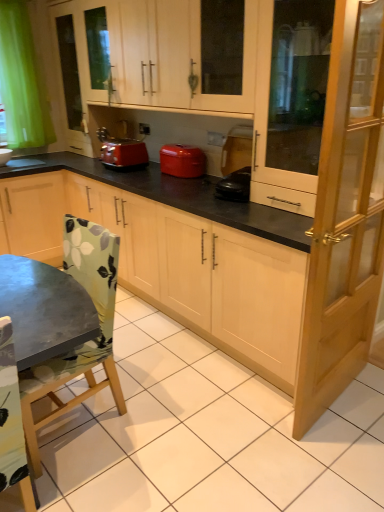
Question: Considering the positions of light brown wooden screen door at right, which is counted as the second screen door, starting from the top, and green fabric chair at lower left in the image, is light brown wooden screen door at right, which is counted as the second screen door, starting from the top, bigger or smaller than green fabric chair at lower left?

Choices:
 (A) small
 (B) big

Answer: (A)

Question: Is point (359, 364) closer or farther from the camera than point (87, 394)?

Choices:
 (A) closer
 (B) farther

Answer: (B)

Question: Considering the real-world distances, which object is closest to the matte wood cabinet at upper center, which ranks as the 2th cabinetry in bottom-to-top order?

Choices:
 (A) matte wood cabinet at center, which appears as the second cabinetry when viewed from the top
 (B) matte red toaster at center
 (C) white glossy sink at lower left
 (D) black plastic coffee maker at center
 (E) transparent glass cabinet at right, which is counted as the 2th screen door, starting from the bottom

Answer: (E)

Question: Estimate the real-world distances between objects in this image. Which object is farther from the light brown wooden screen door at right, positioned as the first screen door in bottom-to-top order?

Choices:
 (A) matte wood cabinet at upper center, the first cabinetry from the top
 (B) white glossy sink at lower left
 (C) matte red toaster at center
 (D) matte wood cabinet at center, the 1th cabinetry in the bottom-to-top sequence
 (E) transparent glass cabinet at right, which is counted as the 2th screen door, starting from the bottom

Answer: (B)